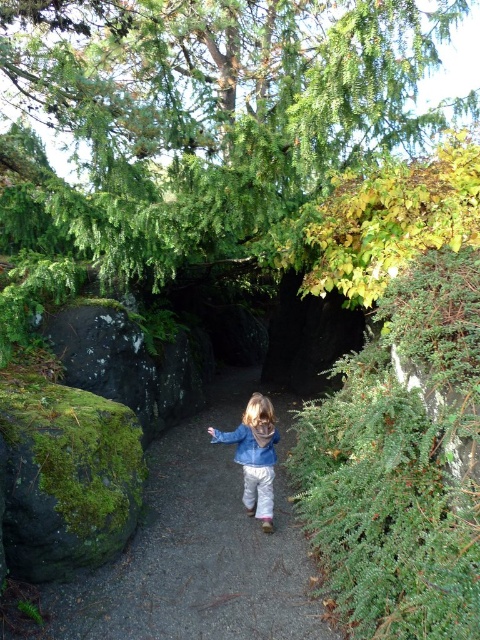
Is mossy stone path at center further to the viewer compared to blue denim jacket at center?

No, it is in front of blue denim jacket at center.

Does point (193, 595) come farther from viewer compared to point (245, 440)?

No.

Locate an element on the screen. mossy stone path at center is located at coordinates (x=197, y=552).

The width and height of the screenshot is (480, 640). Describe the element at coordinates (254, 456) in the screenshot. I see `denim jacket at center` at that location.

Does denim jacket at center have a smaller size compared to blue denim jacket at center?

No.

Is point (271, 426) less distant than point (272, 442)?

That is True.

You are a GUI agent. You are given a task and a screenshot of the screen. Output one action in this format:
    pyautogui.click(x=<x>, y=<y>)
    Task: Click on the denim jacket at center
    
    Given the screenshot: What is the action you would take?
    pyautogui.click(x=254, y=456)

Can you confirm if green leafy tree at upper center is taller than blue denim jacket at center?

Yes, green leafy tree at upper center is taller than blue denim jacket at center.

Is point (250, 76) less distant than point (252, 435)?

No, (250, 76) is behind (252, 435).

Is point (312, 109) closer to camera compared to point (265, 445)?

That is True.

Identify the location of green leafy tree at upper center. This screenshot has height=640, width=480. (218, 109).